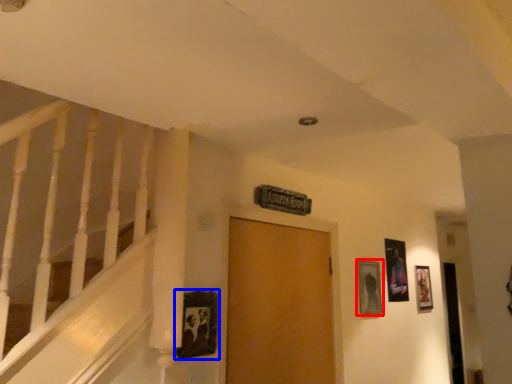
Question: Which point is further to the camera, picture frame (highlighted by a red box) or picture frame (highlighted by a blue box)?

Choices:
 (A) picture frame
 (B) picture frame

Answer: (A)